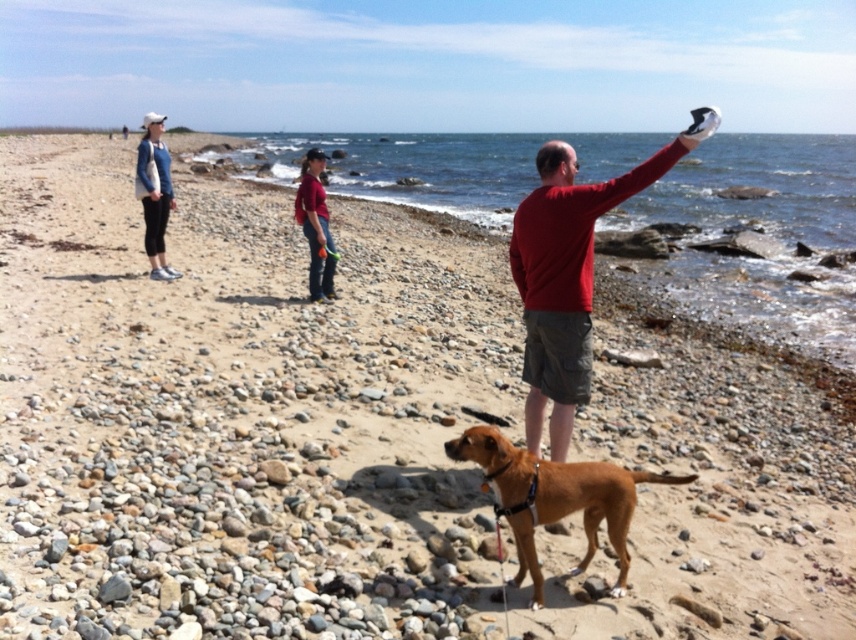
Which is more to the right, blue cotton shirt at upper left or matte red shirt at center?

matte red shirt at center is more to the right.

Is blue cotton shirt at upper left positioned behind matte red shirt at center?

That is True.

The height and width of the screenshot is (640, 856). What are the coordinates of `blue cotton shirt at upper left` in the screenshot? It's located at (153, 193).

Where is `blue cotton shirt at upper left`? blue cotton shirt at upper left is located at coordinates (153, 193).

Who is lower down, brown leather dog at center or matte red shirt at center?

brown leather dog at center

At what (x,y) coordinates should I click in order to perform the action: click on brown leather dog at center. Please return your answer as a coordinate pair (x, y). The image size is (856, 640). Looking at the image, I should click on (554, 497).

Where is `brown leather dog at center`? This screenshot has width=856, height=640. brown leather dog at center is located at coordinates (554, 497).

Who is taller, red matte sweater at center or brown leather dog at center?

With more height is red matte sweater at center.

Is the position of red matte sweater at center less distant than that of brown leather dog at center?

That is False.

This screenshot has height=640, width=856. Find the location of `red matte sweater at center`. red matte sweater at center is located at coordinates (569, 273).

Locate an element on the screen. The image size is (856, 640). red matte sweater at center is located at coordinates (569, 273).